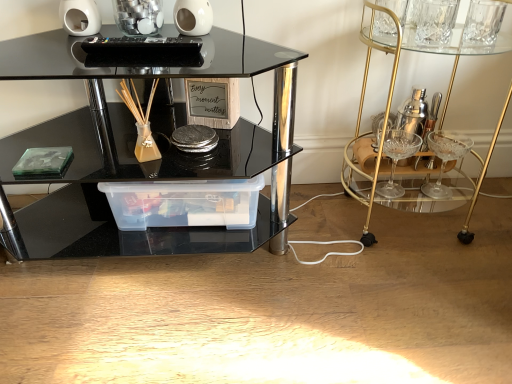
Question: Is point (268, 157) positioned closer to the camera than point (160, 198)?

Choices:
 (A) farther
 (B) closer

Answer: (B)

Question: From the image's perspective, is black glass table at center positioned above or below transparent plastic container at center?

Choices:
 (A) below
 (B) above

Answer: (B)

Question: Which of these objects is positioned closest to the black glass table at center?

Choices:
 (A) transparent plastic container at center
 (B) gold glass bar cart at right

Answer: (A)

Question: Which is farther from the gold glass bar cart at right?

Choices:
 (A) black glass table at center
 (B) transparent plastic container at center

Answer: (A)